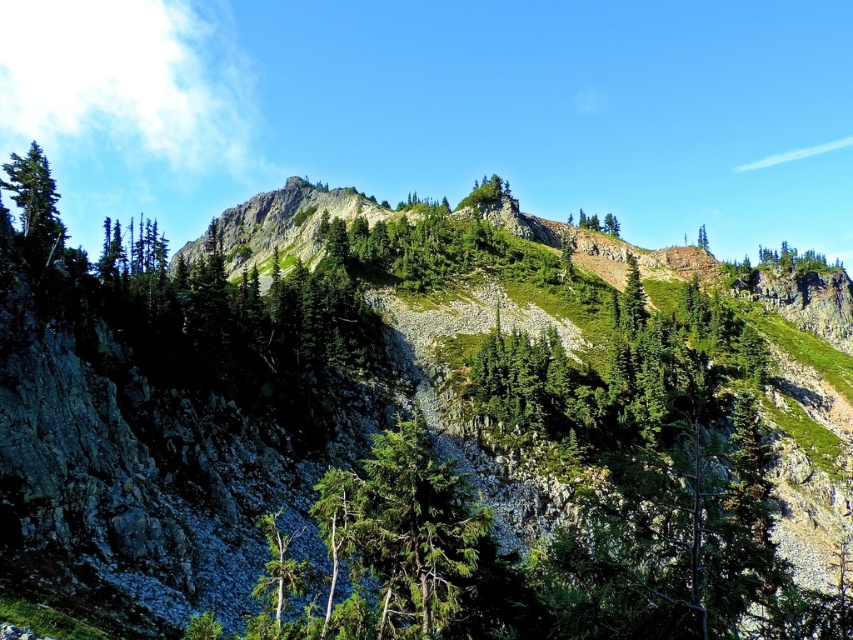
You are a hiker planning to take a photo of the green matte tree at upper left and the green matte tree at lower center from a viewpoint that allows you to see both trees. Based on their sizes, which tree will appear closer to the camera in the photo?

The green matte tree at upper left is larger in size than the green matte tree at lower center, so it will appear closer to the camera in the photo because larger objects typically appear nearer when viewed from the same distance.

You are a hiker planning to set up a tent in the mountainous area shown. You have two options for the location of your tent. One is on the green grassy hillside at upper center, and the other is near the green matte tree at upper center. Which location offers more space for your tent?

The green grassy hillside at upper center is larger in size than the green matte tree at upper center, so the green grassy hillside at upper center offers more space for your tent.

You are a hiker who wants to take a photo of the green matte tree at lower center and the green matte tree at upper center. Which tree should you stand closer to in order to capture both in a single frame without zooming?

You should stand closer to the green matte tree at lower center because it is shorter than the green matte tree at upper center, allowing both to fit within the frame when positioned nearer to the shorter tree.